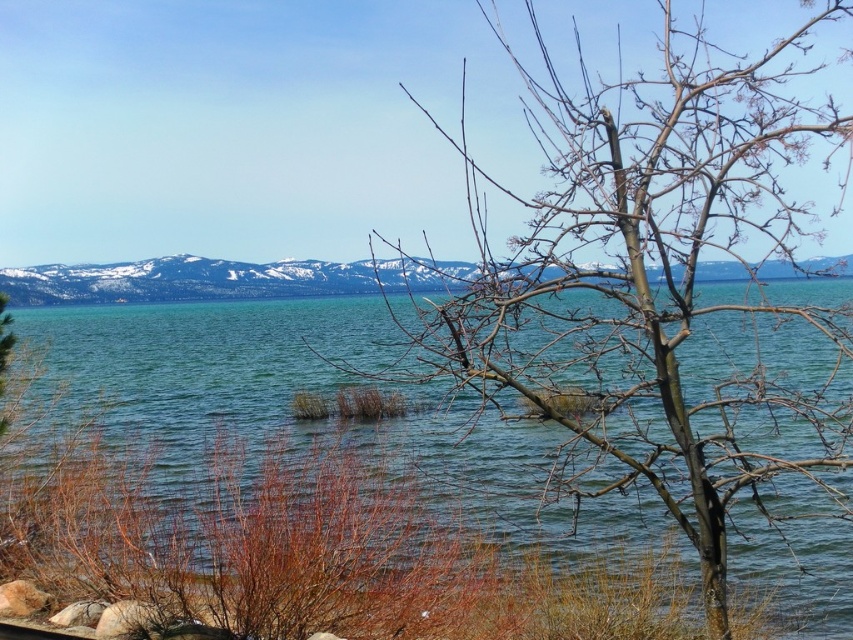
You are standing at the lakeside and want to take a photo of both the bare branches at center and the snowy mountain at center. Which object should you focus on first to ensure both are in sharp focus?

You should focus on the snowy mountain at center first because the bare branches at center is closer to the viewer, so adjusting focus from far to near allows both to be in focus with proper depth of field.

You are an artist trying to sketch the scene. You want to place the bare branches at center in your drawing. According to the coordinates provided, where should you position them on your canvas? Please provide the coordinates in the format of a point like this example format of point format. The canvas is divided into a grid with coordinates ranging from 0 to 1 in both x and y axes. The origin is at the bottom left corner of the canvas.

The bare branches at center should be positioned at point [647,275] on the canvas.

You are standing at the lakeside and see two points marked in the image. The first point is at coordinates point (618,352) and the second is at point (534,465). Which point is closer to you?

Point (618,352) is in front of point (534,465), so it is closer to you.